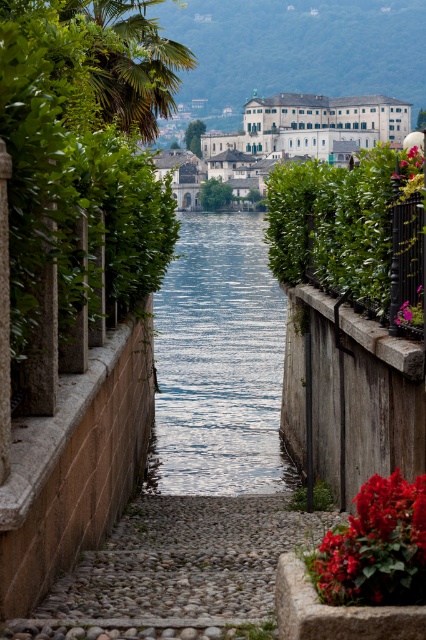
In the scene shown: You are standing on the cobblestone pathway and want to pick both the vivid red petals at lower right and the vivid pink petals at center. Which direction should you walk first to reach the closest one?

The vivid red petals at lower right are to the left of the vivid pink petals at center. Since you are on the cobblestone pathway, you should walk left to reach the vivid red petals at lower right first as they are closer.

You are planning to take a photo of the blue water at center and rustic cobblestone path at center. Which object should you focus on first if you want to capture both in a single frame without moving the camera?

You should focus on the blue water at center first because it has a larger size compared to the rustic cobblestone path at center, making it the dominant subject in the frame.

Consider the image. You are standing on the rustic cobblestone path at center and want to reach the green leafy bush at right. Which direction should you move to get closer to the bush?

You should move to the right because the rustic cobblestone path at center is positioned on the left side of the green leafy bush at right, so moving right along the path will bring you closer to the bush.